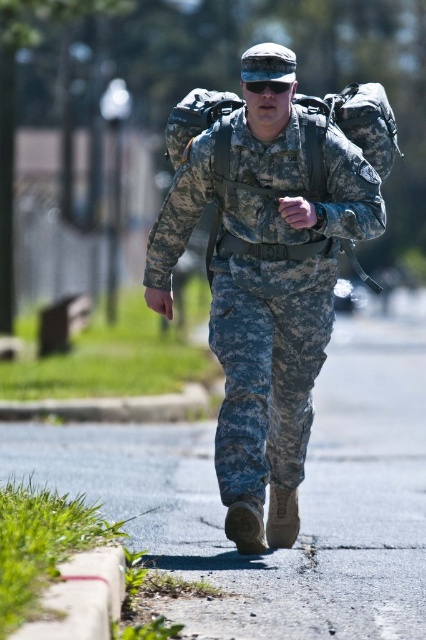
Is asphalt pavement at center to the left of camouflage fabric uniform at center from the viewer's perspective?

In fact, asphalt pavement at center is to the right of camouflage fabric uniform at center.

Between asphalt pavement at center and camouflage fabric uniform at center, which one is positioned higher?

Positioned higher is camouflage fabric uniform at center.

At what (x,y) coordinates should I click in order to perform the action: click on asphalt pavement at center. Please return your answer as a coordinate pair (x, y). The width and height of the screenshot is (426, 640). Looking at the image, I should click on (299, 497).

Can you confirm if camouflage fabric uniform at center is thinner than black matte goggles at center?

No, camouflage fabric uniform at center is not thinner than black matte goggles at center.

Which is in front, point (255, 344) or point (261, 86)?

Point (261, 86)

This screenshot has width=426, height=640. Identify the location of camouflage fabric uniform at center. (267, 276).

This screenshot has width=426, height=640. What do you see at coordinates (299, 497) in the screenshot? I see `asphalt pavement at center` at bounding box center [299, 497].

Measure the distance between asphalt pavement at center and camera.

A distance of 5.01 meters exists between asphalt pavement at center and camera.

Identify the location of asphalt pavement at center. The image size is (426, 640). (299, 497).